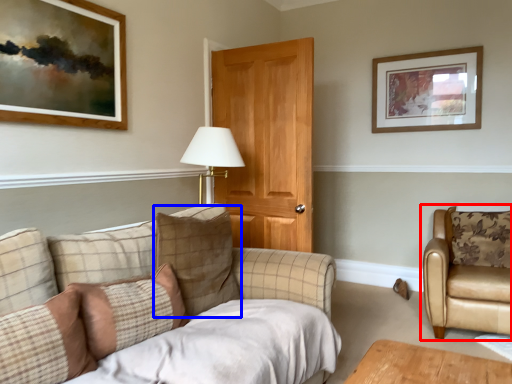
Question: Which object is further to the camera taking this photo, chair (highlighted by a red box) or pillow (highlighted by a blue box)?

Choices:
 (A) chair
 (B) pillow

Answer: (A)